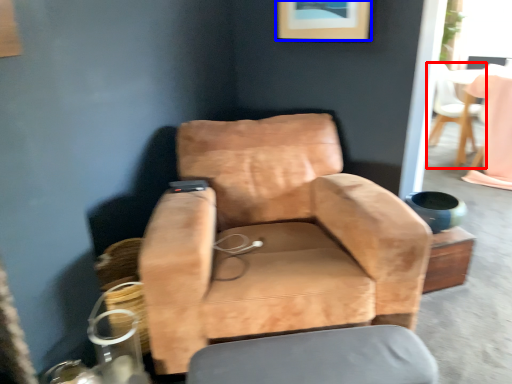
Question: Which of the following is the closest to the observer, chair (highlighted by a red box) or picture frame (highlighted by a blue box)?

Choices:
 (A) chair
 (B) picture frame

Answer: (B)